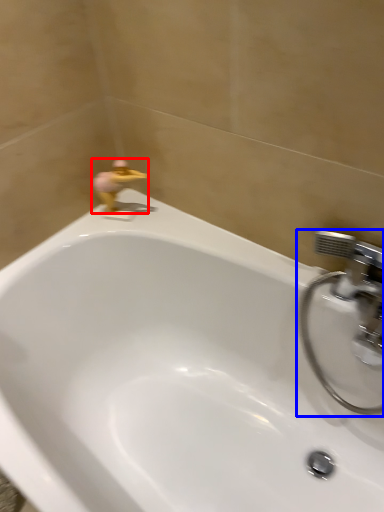
Question: Among these objects, which one is nearest to the camera, plumbing fixture (highlighted by a red box) or tap (highlighted by a blue box)?

Choices:
 (A) plumbing fixture
 (B) tap

Answer: (B)